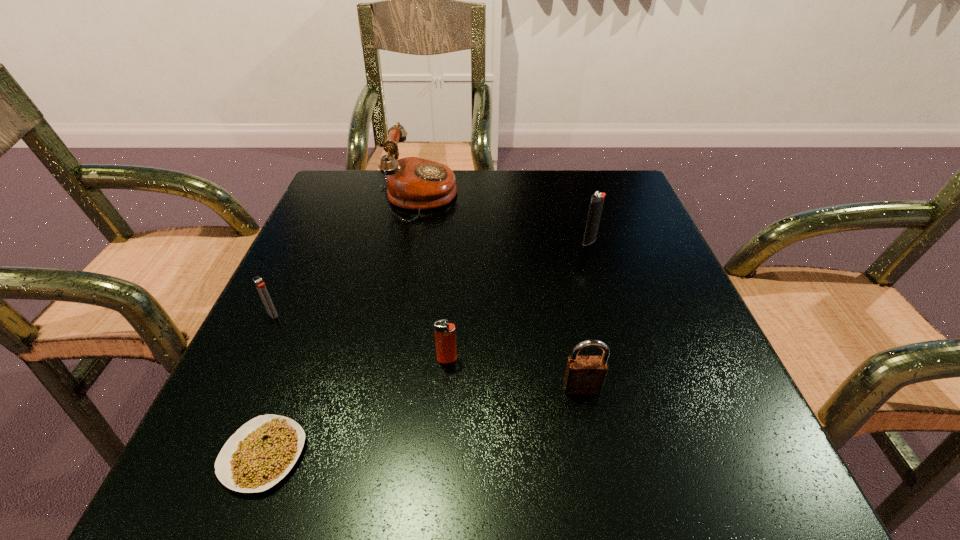
Where is `vacant space that satisfies the following two spatial constraints: 1. on the dial of the rightmost igniter; 2. on the left side of the tallest object`? This screenshot has height=540, width=960. vacant space that satisfies the following two spatial constraints: 1. on the dial of the rightmost igniter; 2. on the left side of the tallest object is located at coordinates (414, 241).

Identify the location of free space that satisfies the following two spatial constraints: 1. on the back side of the farthest igniter; 2. on the dial of the telephone. This screenshot has height=540, width=960. (576, 198).